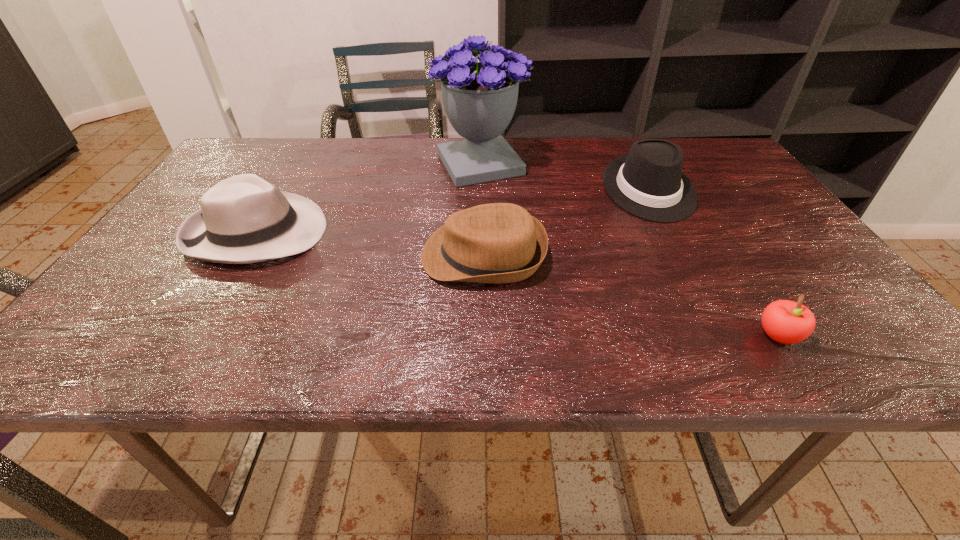
Image resolution: width=960 pixels, height=540 pixels. I want to click on vacant area between the leftmost fedora and the rightmost fedora, so click(452, 211).

At what (x,y) coordinates should I click in order to perform the action: click on vacant region between the rightmost fedora and the leftmost fedora. Please return your answer as a coordinate pair (x, y). Looking at the image, I should click on (452, 211).

The width and height of the screenshot is (960, 540). I want to click on vacant space in between the second fedora from left to right and the apple, so click(631, 295).

Identify the location of the fourth closest object to the second fedora from right to left. The image size is (960, 540). (787, 322).

Locate an element on the screen. This screenshot has height=540, width=960. the third closest object to the leftmost object is located at coordinates (648, 182).

You are a GUI agent. You are given a task and a screenshot of the screen. Output one action in this format:
    pyautogui.click(x=<x>, y=<y>)
    Task: Click on the fedora that stands as the closest to the leftmost object
    Image resolution: width=960 pixels, height=540 pixels.
    Given the screenshot: What is the action you would take?
    pyautogui.click(x=499, y=243)

Choose which fedora is the nearest neighbor to the rightmost fedora. Please provide its 2D coordinates. Your answer should be formatted as a tuple, i.e. [(x, y)], where the tuple contains the x and y coordinates of a point satisfying the conditions above.

[(499, 243)]

Locate an element on the screen. The image size is (960, 540). vacant region that satisfies the following two spatial constraints: 1. on the front-facing side of the rightmost fedora; 2. on the front-facing side of the leftmost fedora is located at coordinates (670, 232).

The height and width of the screenshot is (540, 960). What are the coordinates of `free location that satisfies the following two spatial constraints: 1. on the front-facing side of the shortest fedora; 2. on the back side of the apple` in the screenshot? It's located at (484, 335).

You are a GUI agent. You are given a task and a screenshot of the screen. Output one action in this format:
    pyautogui.click(x=<x>, y=<y>)
    Task: Click on the vacant space that satisfies the following two spatial constraints: 1. on the front-facing side of the rightmost fedora; 2. on the front-facing side of the second fedora from left to right
    This screenshot has width=960, height=540.
    Given the screenshot: What is the action you would take?
    pyautogui.click(x=683, y=255)